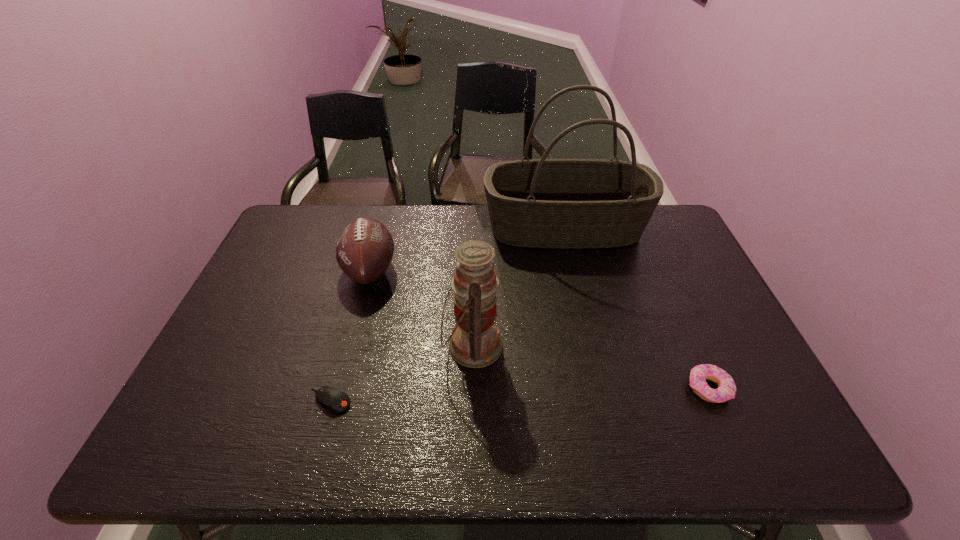
Where is `basket that is at the far edge`? This screenshot has height=540, width=960. basket that is at the far edge is located at coordinates coord(543,203).

Where is `football (American) located in the far edge section of the desktop`? This screenshot has width=960, height=540. football (American) located in the far edge section of the desktop is located at coordinates (364, 250).

Identify the location of basket positioned at the right edge. This screenshot has width=960, height=540. (543, 203).

Identify the location of doughnut situated at the right edge. The width and height of the screenshot is (960, 540). (726, 390).

Identify the location of object that is at the far right corner. (543, 203).

The image size is (960, 540). In the image, there is a desktop. Find the location of `vacant space at the far edge`. vacant space at the far edge is located at coordinates (393, 219).

Identify the location of vacant space at the near edge. The width and height of the screenshot is (960, 540). (690, 457).

In the image, there is a desktop. Where is `blank space at the left edge`? The height and width of the screenshot is (540, 960). blank space at the left edge is located at coordinates [x=260, y=314].

The height and width of the screenshot is (540, 960). Identify the location of vacant space at the right edge of the desktop. (689, 284).

Locate an element on the screen. vacant space at the near left corner of the desktop is located at coordinates (211, 454).